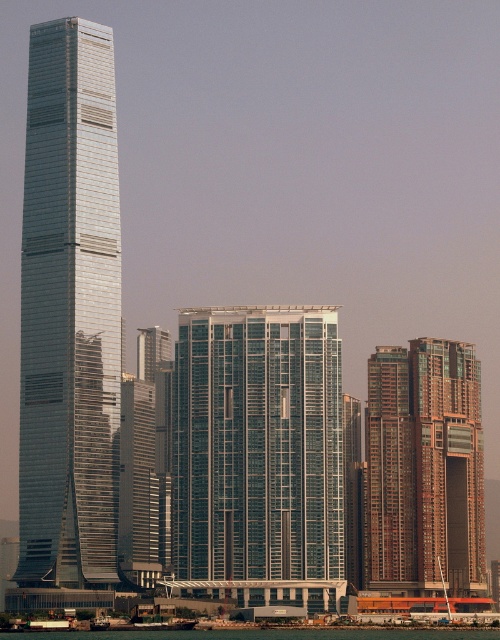
Is brown glassy building at right taller than green water at lower center?

Yes.

Is brown glassy building at right to the left of green water at lower center from the viewer's perspective?

No, brown glassy building at right is not to the left of green water at lower center.

At what (x,y) coordinates should I click in order to perform the action: click on brown glassy building at right. Please return your answer as a coordinate pair (x, y). This screenshot has height=640, width=500. Looking at the image, I should click on (425, 467).

Find the location of `brown glassy building at right`. brown glassy building at right is located at coordinates (425, 467).

Who is positioned more to the left, shiny glass skyscraper at left or brown glassy building at right?

shiny glass skyscraper at left is more to the left.

Locate an element on the screen. The height and width of the screenshot is (640, 500). shiny glass skyscraper at left is located at coordinates (70, 310).

Is shiny glass skyscraper at left bigger than glassy metallic building at center?

Yes.

Is point (94, 540) positioned after point (191, 564)?

Yes, point (94, 540) is behind point (191, 564).

Is point (111, 458) closer to viewer compared to point (207, 339)?

No, (111, 458) is further to viewer.

This screenshot has width=500, height=640. What are the coordinates of `shiny glass skyscraper at left` in the screenshot? It's located at (70, 310).